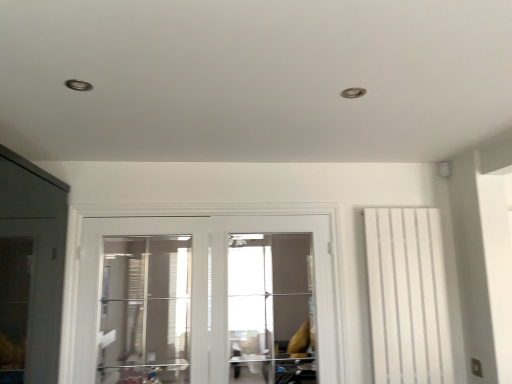
Question: Considering the relative positions of transparent glass door at center and white matte radiator at right in the image provided, is transparent glass door at center to the right of white matte radiator at right from the viewer's perspective?

Choices:
 (A) no
 (B) yes

Answer: (A)

Question: Does transparent glass door at center have a greater height compared to white matte radiator at right?

Choices:
 (A) no
 (B) yes

Answer: (A)

Question: Does transparent glass door at center come behind white matte radiator at right?

Choices:
 (A) no
 (B) yes

Answer: (A)

Question: From a real-world perspective, does transparent glass door at center stand above white matte radiator at right?

Choices:
 (A) yes
 (B) no

Answer: (A)

Question: Could you tell me if transparent glass door at center is turned towards white matte radiator at right?

Choices:
 (A) no
 (B) yes

Answer: (A)

Question: Is transparent glass door at center turned away from white matte radiator at right?

Choices:
 (A) yes
 (B) no

Answer: (B)

Question: Is the depth of transparent glass screen door at center less than that of transparent glass door at center?

Choices:
 (A) no
 (B) yes

Answer: (A)

Question: Is transparent glass screen door at center oriented towards transparent glass door at center?

Choices:
 (A) yes
 (B) no

Answer: (B)

Question: Considering the relative sizes of transparent glass screen door at center and transparent glass door at center in the image provided, is transparent glass screen door at center bigger than transparent glass door at center?

Choices:
 (A) yes
 (B) no

Answer: (A)

Question: From the image's perspective, is transparent glass screen door at center under transparent glass door at center?

Choices:
 (A) yes
 (B) no

Answer: (A)

Question: Can you confirm if transparent glass screen door at center is wider than transparent glass door at center?

Choices:
 (A) yes
 (B) no

Answer: (A)

Question: Considering the relative sizes of transparent glass screen door at center and transparent glass door at center in the image provided, is transparent glass screen door at center shorter than transparent glass door at center?

Choices:
 (A) no
 (B) yes

Answer: (A)

Question: Does white glossy door at center appear on the left side of transparent glass screen door at center?

Choices:
 (A) yes
 (B) no

Answer: (A)